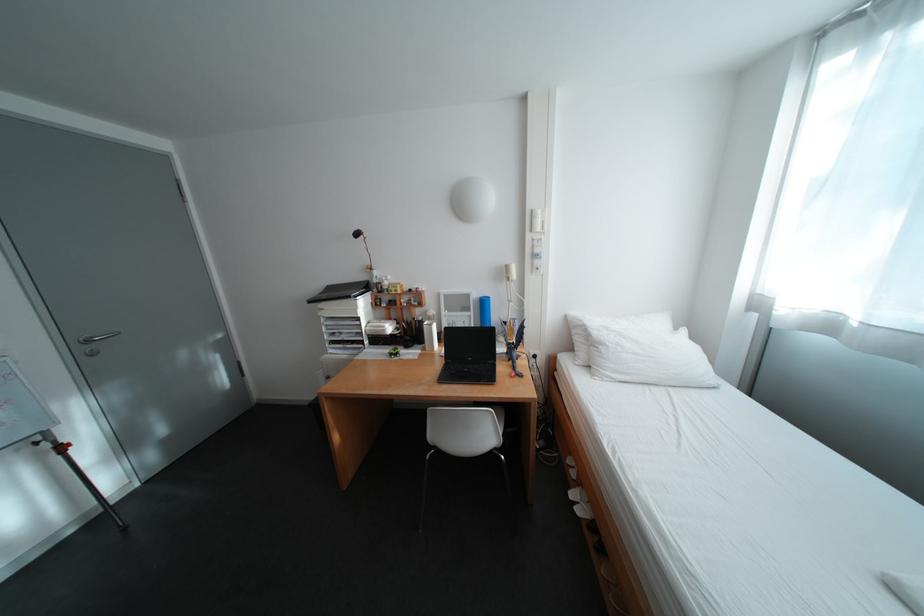
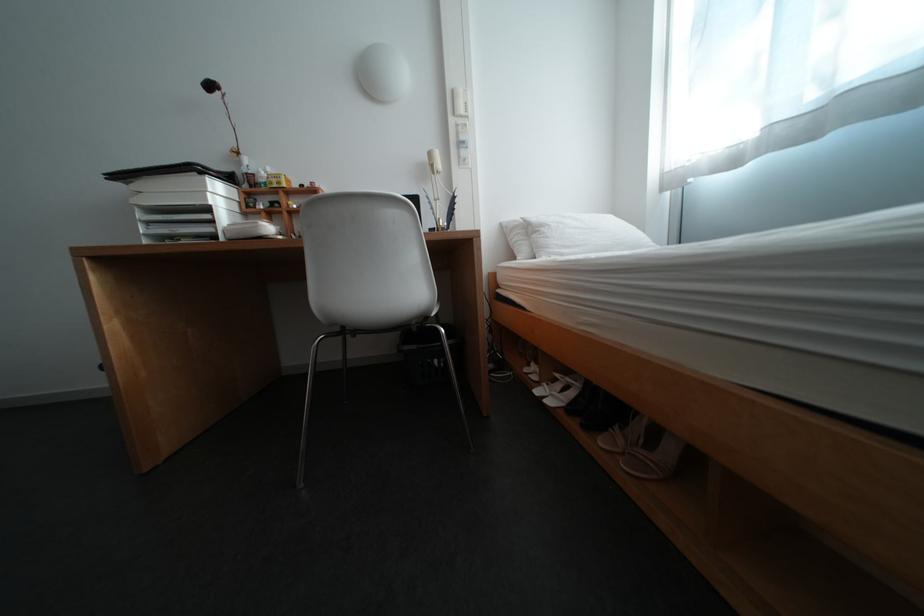
Question: The camera is either moving clockwise (left) or counter-clockwise (right) around the object. The first image is from the beginning of the video and the second image is from the end. Is the camera moving left or right when shooting the video?

Choices:
 (A) Left
 (B) Right

Answer: (A)